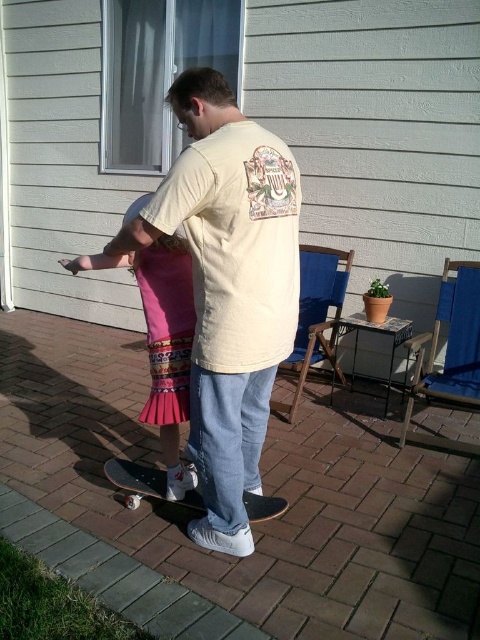
You are standing on the brick pavement at center and want to reach a skateboard that is placed 5 feet away from you. Can you reach it without moving your feet?

The brick pavement at center is 4.88 feet away from the viewer, so the skateboard is slightly farther away than that. You cannot reach it without moving your feet.

You are a photographer trying to capture a photo of the skateboarder and the girl. Since the brick pavement at center and the pink pleated skirt at center are both in the scene, where is the brick pavement located relative to the skirt?

The brick pavement at center is positioned under the pink pleated skirt at center, meaning it is beneath the skirt in the image.